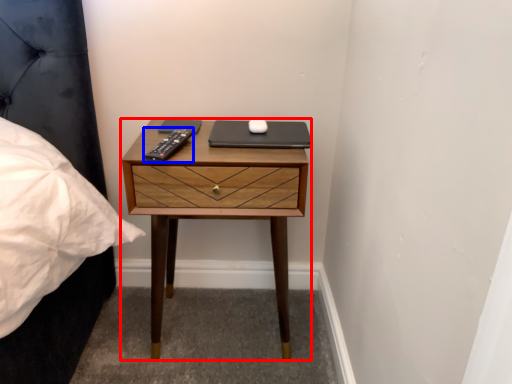
Question: Which object appears farthest to the camera in this image, nightstand (highlighted by a red box) or remote (highlighted by a blue box)?

Choices:
 (A) nightstand
 (B) remote

Answer: (A)